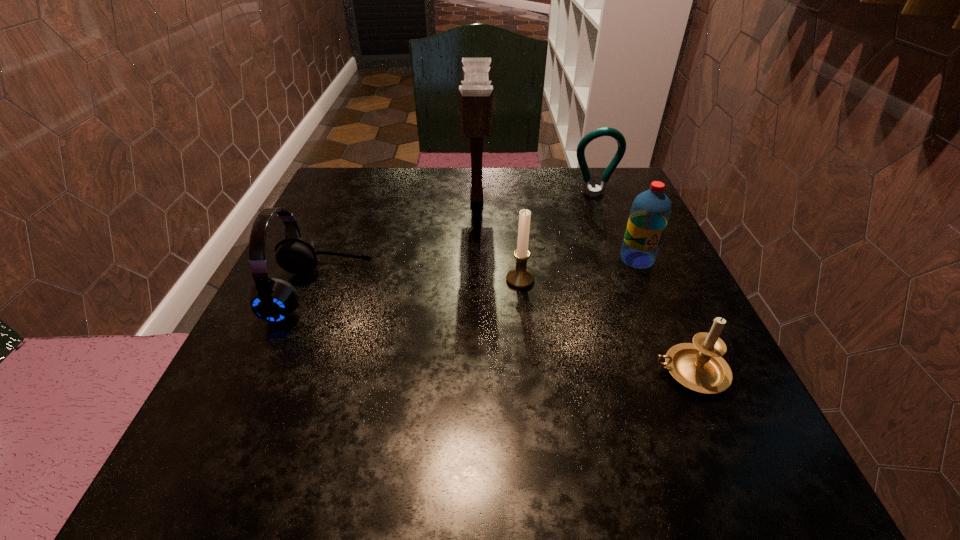
Image resolution: width=960 pixels, height=540 pixels. I want to click on free spot between the farther candle holder and the water bottle, so click(579, 269).

You are a GUI agent. You are given a task and a screenshot of the screen. Output one action in this format:
    pyautogui.click(x=<x>, y=<y>)
    Task: Click on the blank region between the leftmost object and the bottle opener
    Image resolution: width=960 pixels, height=540 pixels.
    Given the screenshot: What is the action you would take?
    pyautogui.click(x=457, y=244)

Image resolution: width=960 pixels, height=540 pixels. I want to click on empty space that is in between the shortest object and the left candle holder, so click(x=605, y=326).

This screenshot has height=540, width=960. In order to click on free space between the headset and the third object from left to right in this screenshot , I will do `click(420, 286)`.

The height and width of the screenshot is (540, 960). What are the coordinates of `free space that is in between the right candle holder and the water bottle` in the screenshot? It's located at (663, 315).

You are a GUI agent. You are given a task and a screenshot of the screen. Output one action in this format:
    pyautogui.click(x=<x>, y=<y>)
    Task: Click on the empty location between the mallet and the headset
    Image resolution: width=960 pixels, height=540 pixels.
    Given the screenshot: What is the action you would take?
    pyautogui.click(x=398, y=246)

In order to click on free point between the shortest object and the second object from left to right in this screenshot , I will do `click(584, 286)`.

Find the location of a particular element. This screenshot has width=960, height=540. vacant area between the bottle opener and the mallet is located at coordinates (536, 197).

Where is `empty space between the left candle holder and the leftmost object`? This screenshot has width=960, height=540. empty space between the left candle holder and the leftmost object is located at coordinates (420, 286).

At what (x,y) coordinates should I click in order to perform the action: click on vacant space that is in between the water bottle and the headset. Please return your answer as a coordinate pair (x, y). Image resolution: width=960 pixels, height=540 pixels. Looking at the image, I should click on (478, 276).